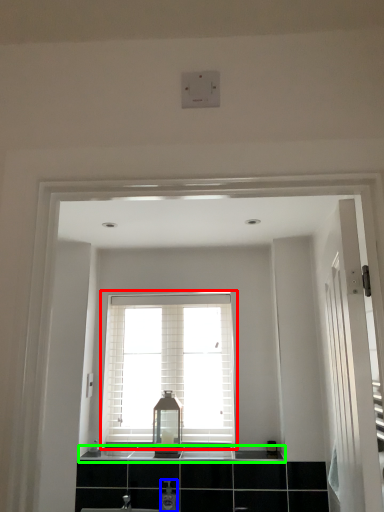
Question: Which object is positioned farthest from window (highlighted by a red box)? Select from toiletry (highlighted by a blue box) and counter top (highlighted by a green box).

Choices:
 (A) toiletry
 (B) counter top

Answer: (A)